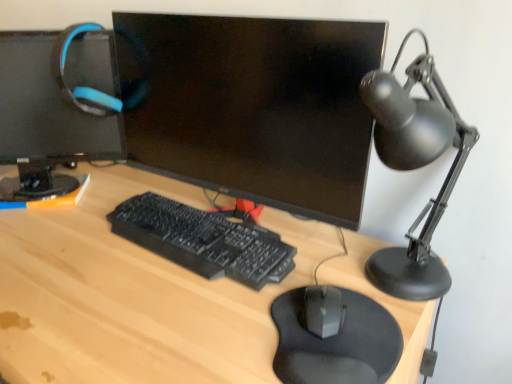
Where is `vacant region under matte black monitor at upper left, placed as the 1th computer monitor when sorted from left to right (from a real-world perspective)`? The width and height of the screenshot is (512, 384). vacant region under matte black monitor at upper left, placed as the 1th computer monitor when sorted from left to right (from a real-world perspective) is located at coordinates (56, 192).